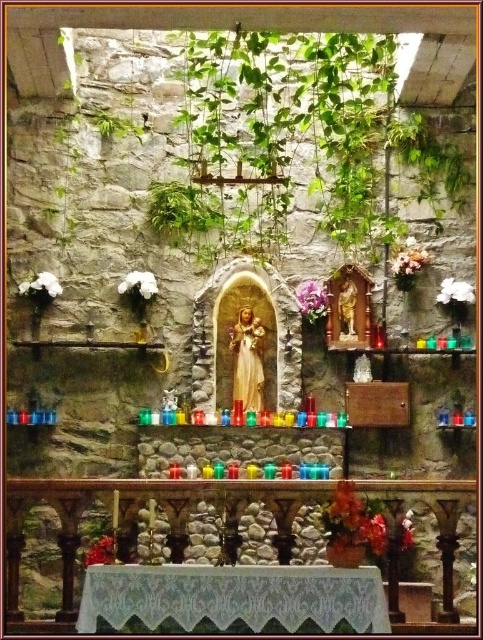
Question: Estimate the real-world distances between objects in this image. Which object is farther from the white matte flower at left?

Choices:
 (A) pink silk flower at upper right
 (B) white fluffy cloud at upper left
 (C) matte red flower at lower right
 (D) purple silk flower at center

Answer: (C)

Question: Which point appears closest to the camera in this image?

Choices:
 (A) (138, 276)
 (B) (312, 289)
 (C) (469, 292)
 (D) (102, 554)

Answer: (D)

Question: Estimate the real-world distances between objects in this image. Which object is closer to the purple silk flower at center?

Choices:
 (A) white matte flower at upper right
 (B) pink silk flower at upper right

Answer: (B)

Question: Is purple silk flower at center below bright red fabric at lower left?

Choices:
 (A) yes
 (B) no

Answer: (B)

Question: In this image, where is matte red flower at lower right located relative to white matte flower at left?

Choices:
 (A) left
 (B) right

Answer: (B)

Question: Observing the image, what is the correct spatial positioning of matte red flower at lower right in reference to white matte flower at upper right?

Choices:
 (A) left
 (B) right

Answer: (A)